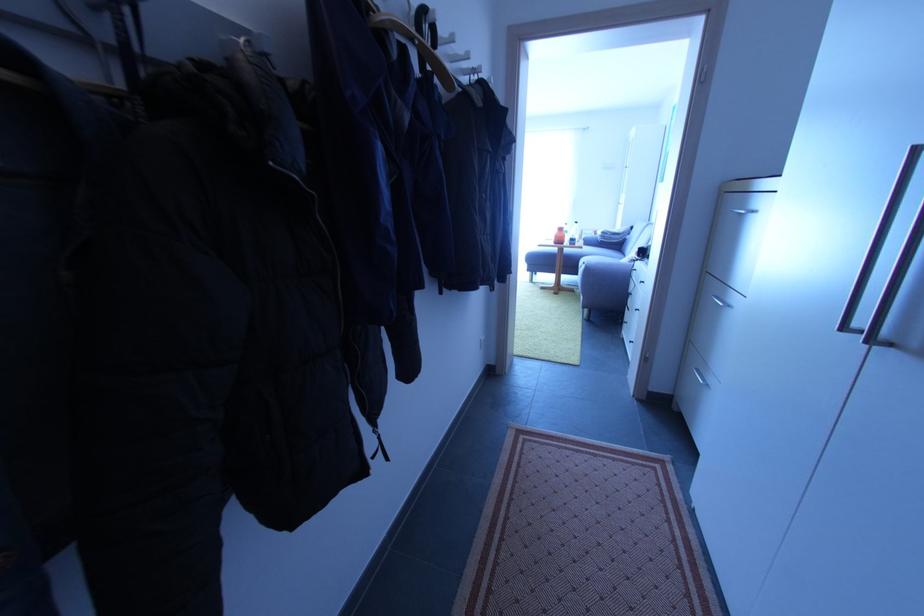
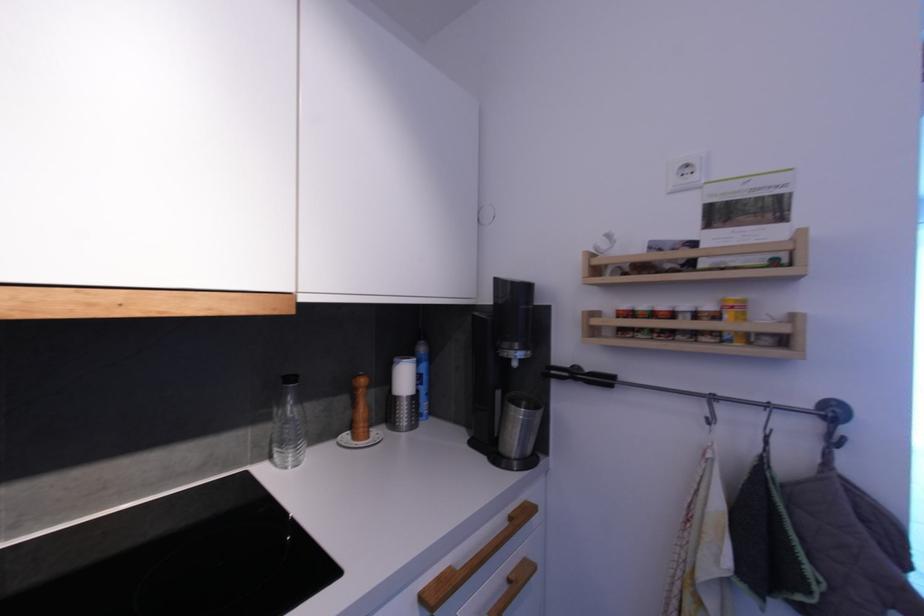
In a continuous first-person perspective shot, in which direction is the camera moving?

The cameraman moved toward left, forward.